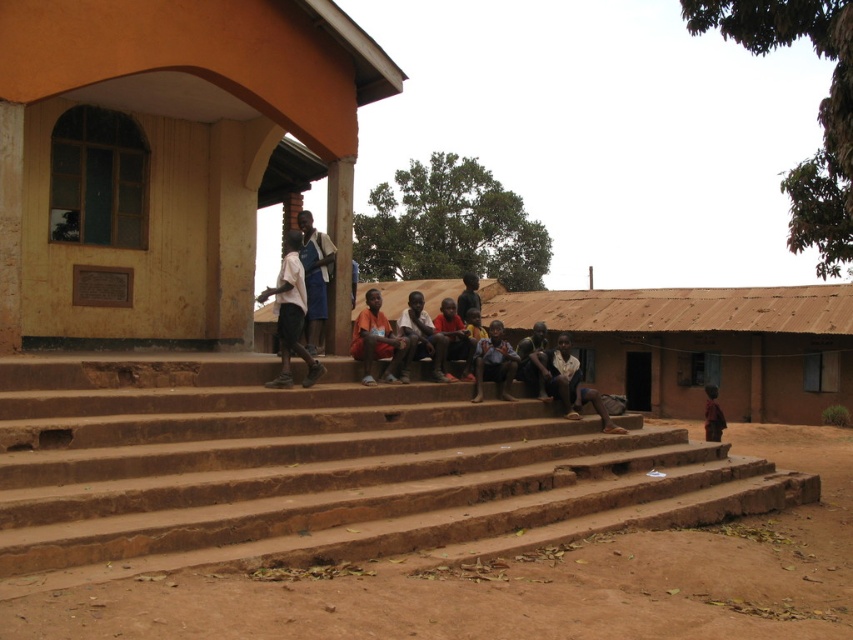
Question: Can you confirm if brown earthen stairs at center is thinner than white shirt at center?

Choices:
 (A) no
 (B) yes

Answer: (B)

Question: Can you confirm if brown earthen stairs at center is smaller than white shirt at center?

Choices:
 (A) no
 (B) yes

Answer: (B)

Question: Which point is farther to the camera?

Choices:
 (A) white fabric shirt at center
 (B) brown fabric shirt at center

Answer: (B)

Question: Among these points, which one is farthest from the camera?

Choices:
 (A) (289, 364)
 (B) (310, 256)
 (C) (706, 428)
 (D) (514, 401)

Answer: (C)

Question: Is brown earthen stairs at center to the right of brown fabric shirt at center from the viewer's perspective?

Choices:
 (A) yes
 (B) no

Answer: (B)

Question: Which point appears farthest from the camera in this image?

Choices:
 (A) (354, 324)
 (B) (283, 339)
 (C) (587, 397)

Answer: (A)